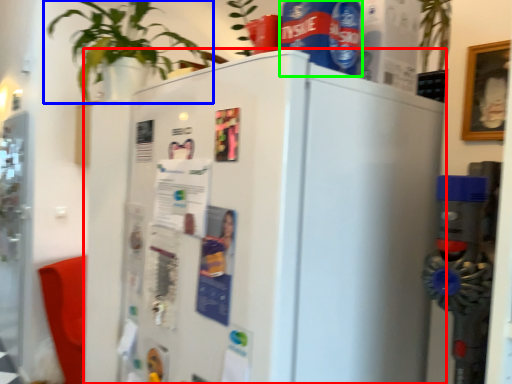
Question: Considering the real-world distances, which object is farthest from refrigerator (highlighted by a red box)? houseplant (highlighted by a blue box) or beverage (highlighted by a green box)?

Choices:
 (A) houseplant
 (B) beverage

Answer: (A)